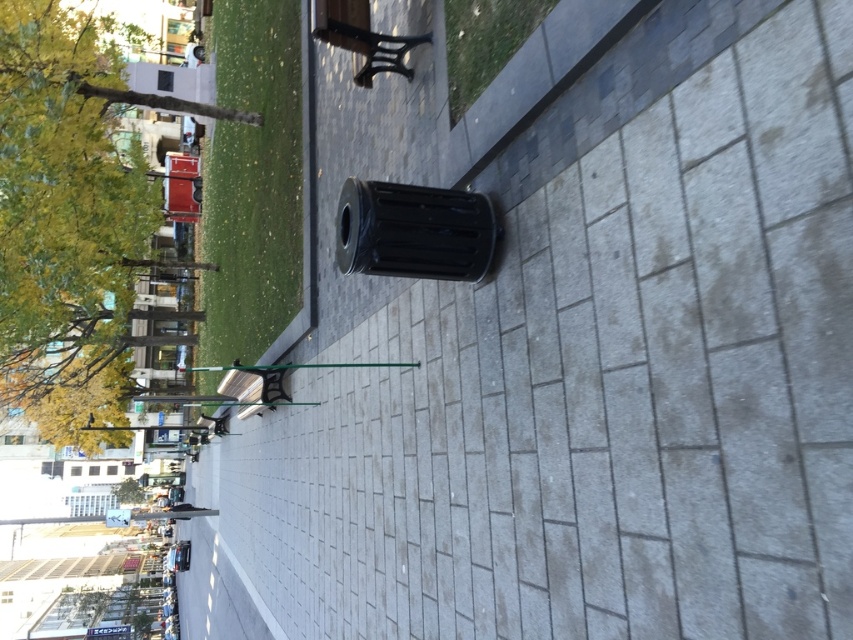
Question: Where is green leafy tree at upper left located in relation to green leafy tree at lower left in the image?

Choices:
 (A) left
 (B) right

Answer: (B)

Question: Can you confirm if green leafy tree at upper left is positioned above green leafy tree at lower left?

Choices:
 (A) no
 (B) yes

Answer: (B)

Question: Which point appears closest to the camera in this image?

Choices:
 (A) (85, 148)
 (B) (125, 502)

Answer: (A)

Question: Which of the following is the farthest from the observer?

Choices:
 (A) green leafy tree at lower left
 (B) green leafy tree at upper left

Answer: (A)

Question: Is green leafy tree at upper left closer to the viewer compared to green leafy tree at lower left?

Choices:
 (A) yes
 (B) no

Answer: (A)